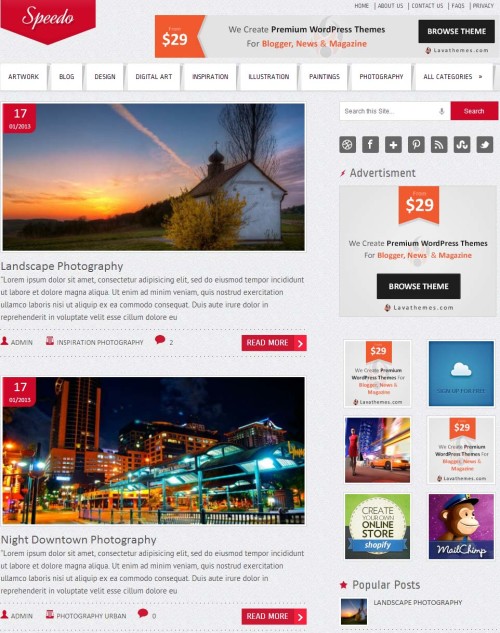
What are the coordinates of `paintings tab` in the screenshot? It's located at (327, 84).